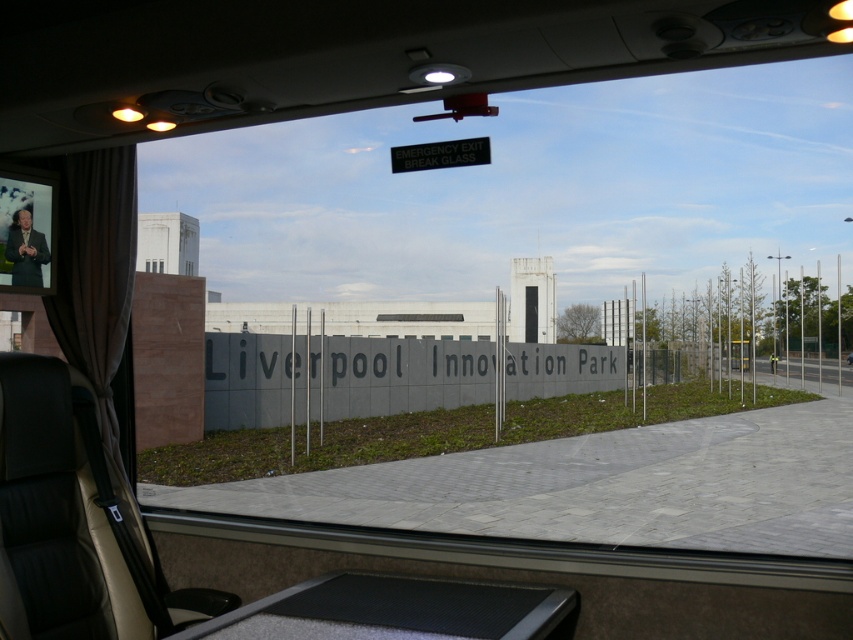
Is clear glass window at center to the right of transparent glass at center from the viewer's perspective?

Incorrect, clear glass window at center is not on the right side of transparent glass at center.

The image size is (853, 640). In order to click on clear glass window at center in this screenshot , I will do `click(154, 266)`.

At what (x,y) coordinates should I click in order to perform the action: click on clear glass window at center. Please return your answer as a coordinate pair (x, y). This screenshot has width=853, height=640. Looking at the image, I should click on (154, 266).

Image resolution: width=853 pixels, height=640 pixels. I want to click on clear glass window at center, so click(154, 266).